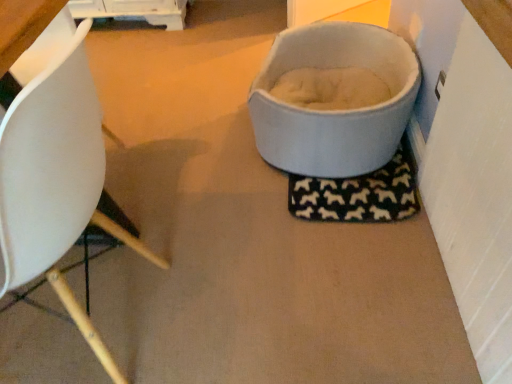
Locate an element on the screen. white matte chair at left is located at coordinates (56, 182).

What do you see at coordinates (56, 182) in the screenshot? This screenshot has width=512, height=384. I see `white matte chair at left` at bounding box center [56, 182].

The height and width of the screenshot is (384, 512). Describe the element at coordinates (334, 111) in the screenshot. I see `light gray fabric pet bed at upper right` at that location.

This screenshot has width=512, height=384. In order to click on light gray fabric pet bed at upper right in this screenshot , I will do `click(334, 111)`.

What is the approximate width of light gray fabric pet bed at upper right?

The width of light gray fabric pet bed at upper right is 25.88 inches.

Locate an element on the screen. This screenshot has height=384, width=512. white matte chair at left is located at coordinates (56, 182).

Considering the relative positions of light gray fabric pet bed at upper right and white matte chair at left in the image provided, is light gray fabric pet bed at upper right to the right of white matte chair at left from the viewer's perspective?

Yes.

Which object is more forward, light gray fabric pet bed at upper right or white matte chair at left?

white matte chair at left is in front.

Considering the positions of points (276, 137) and (57, 202), is point (276, 137) closer to camera compared to point (57, 202)?

No.

Looking at this image, from the image's perspective, is light gray fabric pet bed at upper right positioned above or below white matte chair at left?

light gray fabric pet bed at upper right is above white matte chair at left.

From a real-world perspective, does light gray fabric pet bed at upper right stand above white matte chair at left?

No, from a real-world perspective, light gray fabric pet bed at upper right is not over white matte chair at left

Which object is wider, light gray fabric pet bed at upper right or white matte chair at left?

light gray fabric pet bed at upper right is wider.

From their relative heights in the image, would you say light gray fabric pet bed at upper right is taller or shorter than white matte chair at left?

Clearly, light gray fabric pet bed at upper right is shorter compared to white matte chair at left.

Who is smaller, light gray fabric pet bed at upper right or white matte chair at left?

light gray fabric pet bed at upper right is smaller.

Is light gray fabric pet bed at upper right not within white matte chair at left?

light gray fabric pet bed at upper right lies outside white matte chair at left's area.

Is light gray fabric pet bed at upper right next to white matte chair at left?

No, light gray fabric pet bed at upper right is not in contact with white matte chair at left.

Is light gray fabric pet bed at upper right aimed at white matte chair at left?

No, light gray fabric pet bed at upper right is not turned towards white matte chair at left.

Identify the location of toilet bowl behind the white matte chair at left. This screenshot has width=512, height=384. (334, 111).

Which object is positioned more to the left, white matte chair at left or light gray fabric pet bed at upper right?

white matte chair at left is more to the left.

Which object is closer to the camera, white matte chair at left or light gray fabric pet bed at upper right?

white matte chair at left is closer to the camera.

Which is closer to the camera, (34, 112) or (382, 145)?

Point (34, 112) is closer to the camera than point (382, 145).

From the image's perspective, is white matte chair at left located above light gray fabric pet bed at upper right?

No.

From a real-world perspective, is white matte chair at left positioned above or below light gray fabric pet bed at upper right?

white matte chair at left is above light gray fabric pet bed at upper right.

Which of these two, white matte chair at left or light gray fabric pet bed at upper right, is wider?

light gray fabric pet bed at upper right is wider.

Does white matte chair at left have a greater height compared to light gray fabric pet bed at upper right?

Yes, white matte chair at left is taller than light gray fabric pet bed at upper right.

Which of these two, white matte chair at left or light gray fabric pet bed at upper right, is bigger?

Bigger between the two is white matte chair at left.

Would you say white matte chair at left is inside or outside light gray fabric pet bed at upper right?

white matte chair at left is located beyond the bounds of light gray fabric pet bed at upper right.

Are white matte chair at left and light gray fabric pet bed at upper right far apart?

Actually, white matte chair at left and light gray fabric pet bed at upper right are a little close together.

Is white matte chair at left positioned with its back to light gray fabric pet bed at upper right?

That's not correct — white matte chair at left is not looking away from light gray fabric pet bed at upper right.

How many degrees apart are the facing directions of white matte chair at left and light gray fabric pet bed at upper right?

They differ by 176 degrees in their facing directions.

Locate an element on the screen. This screenshot has width=512, height=384. toilet bowl behind the white matte chair at left is located at coordinates (334, 111).

I want to click on toilet bowl on the right of white matte chair at left, so click(334, 111).

Where is `chair above the light gray fabric pet bed at upper right (from a real-world perspective)`? This screenshot has height=384, width=512. chair above the light gray fabric pet bed at upper right (from a real-world perspective) is located at coordinates (56, 182).